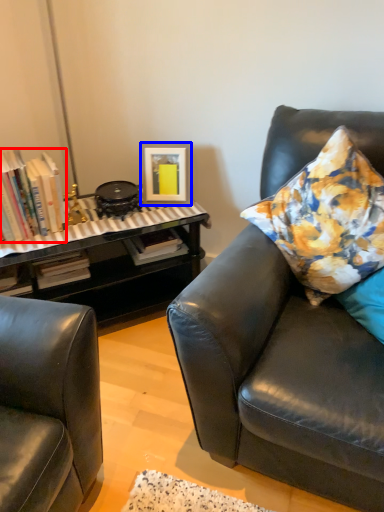
Question: Which object appears closest to the camera in this image, book (highlighted by a red box) or picture frame (highlighted by a blue box)?

Choices:
 (A) book
 (B) picture frame

Answer: (A)